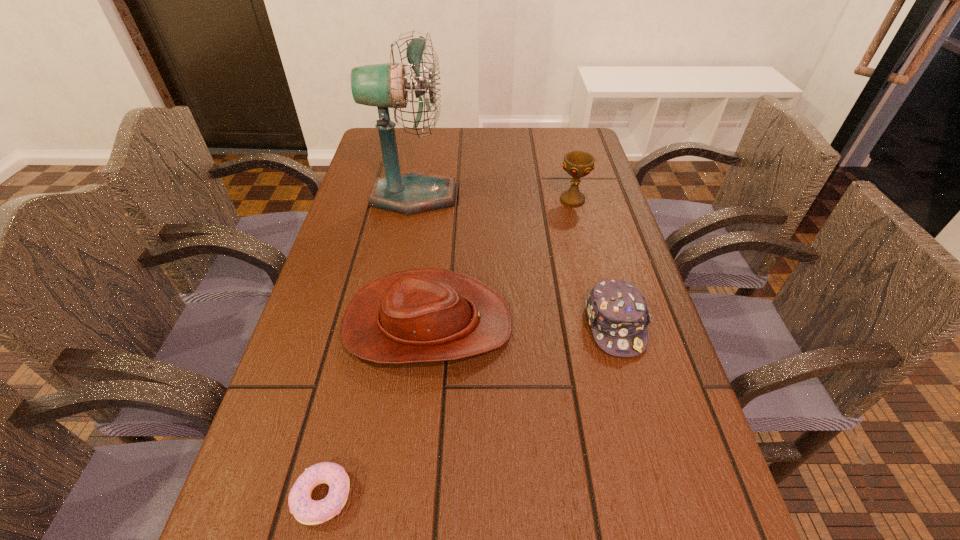
Locate an element on the screen. vacant region located 0.070m on the left of the nearest object is located at coordinates coord(248,496).

This screenshot has width=960, height=540. I want to click on fan at the left edge, so [384, 86].

At what (x,y) coordinates should I click in order to perform the action: click on cowboy hat located in the left edge section of the desktop. Please return your answer as a coordinate pair (x, y). This screenshot has height=540, width=960. Looking at the image, I should click on (420, 315).

At what (x,y) coordinates should I click in order to perform the action: click on doughnut that is positioned at the left edge. Please return your answer as a coordinate pair (x, y). This screenshot has height=540, width=960. Looking at the image, I should click on (305, 510).

You are a GUI agent. You are given a task and a screenshot of the screen. Output one action in this format:
    pyautogui.click(x=<x>, y=<y>)
    Task: Click on the chalice located in the right edge section of the desktop
    Image resolution: width=960 pixels, height=540 pixels.
    Given the screenshot: What is the action you would take?
    pyautogui.click(x=577, y=164)

Where is `headwear positioned at the right edge`? The height and width of the screenshot is (540, 960). headwear positioned at the right edge is located at coordinates (617, 311).

The image size is (960, 540). In the image, there is a desktop. Find the location of `vacant area at the far edge`. vacant area at the far edge is located at coordinates (462, 139).

In the image, there is a desktop. Where is `vacant area at the left edge`? vacant area at the left edge is located at coordinates (337, 410).

Where is `free location at the right edge of the desktop`? free location at the right edge of the desktop is located at coordinates (667, 384).

Image resolution: width=960 pixels, height=540 pixels. What are the coordinates of `free space at the far left corner of the desktop` in the screenshot? It's located at (418, 139).